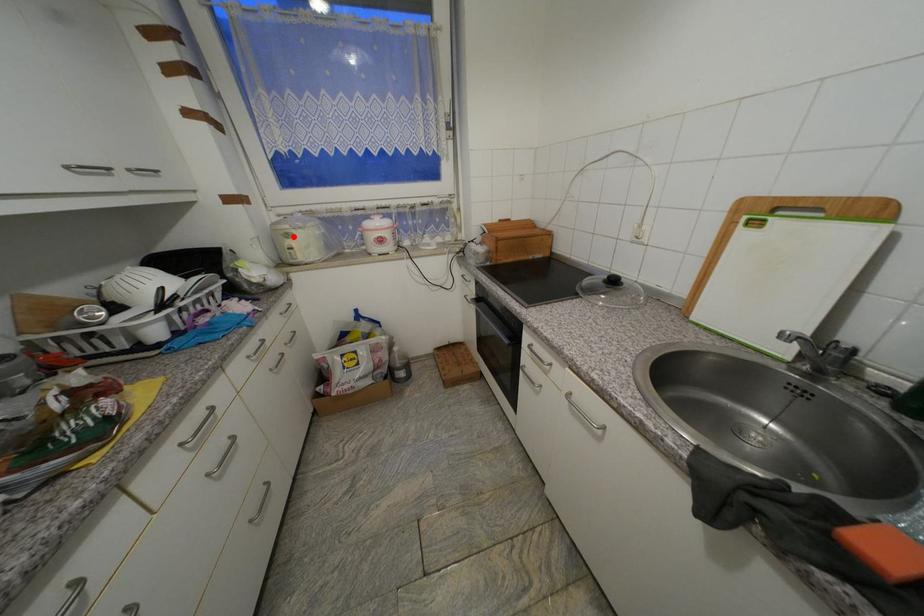
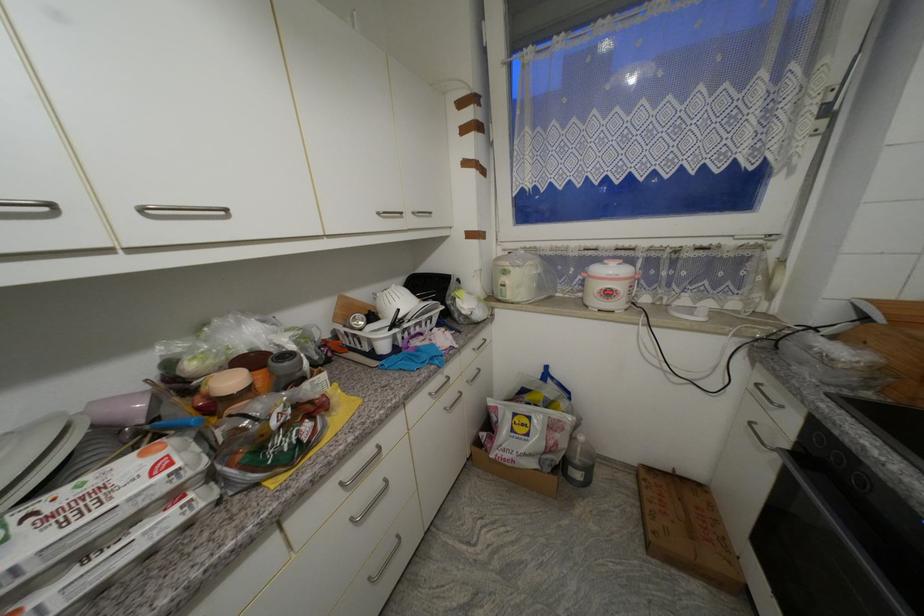
Find the pixel in the second image that matches the highlighted location in the first image.

(511, 274)